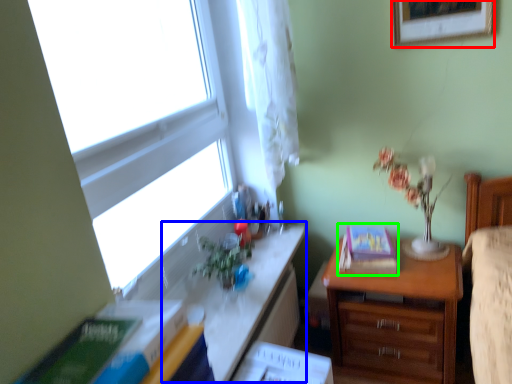
Question: Estimate the real-world distances between objects in this image. Which object is closer to picture frame (highlighted by a red box), table (highlighted by a blue box) or paperback book (highlighted by a green box)?

Choices:
 (A) table
 (B) paperback book

Answer: (B)